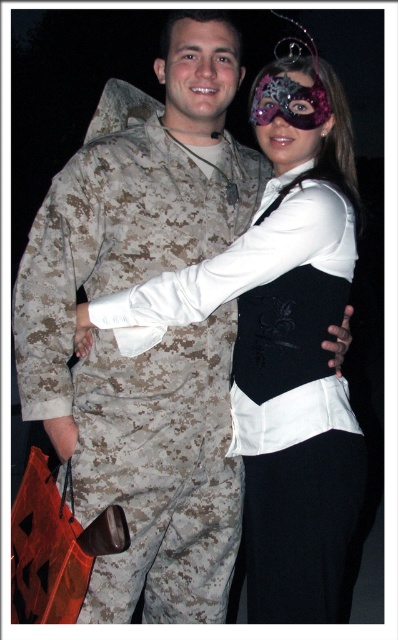
Measure the distance between smooth skin face at center and camera.

smooth skin face at center is 1.76 meters away from camera.

The image size is (398, 640). What do you see at coordinates (200, 74) in the screenshot?
I see `smooth skin face at center` at bounding box center [200, 74].

Who is more forward, (x=199, y=92) or (x=290, y=150)?

Point (x=290, y=150) is in front.

The image size is (398, 640). I want to click on smooth skin face at center, so click(x=200, y=74).

Does matte camouflage uniform at center have a greater width compared to sparkly purple mask at center?

Correct, the width of matte camouflage uniform at center exceeds that of sparkly purple mask at center.

Between point (327, 570) and point (292, 156), which one is positioned behind?

Positioned behind is point (292, 156).

The width and height of the screenshot is (398, 640). I want to click on matte camouflage uniform at center, so click(x=296, y=438).

Is point (238, 417) positioned before point (212, 29)?

No, it is behind (212, 29).

Does matte camouflage uniform at center appear over smooth skin face at center?

No.

Is point (351, 529) behind point (230, 80)?

That is False.

At what (x,y) coordinates should I click in order to perform the action: click on matte camouflage uniform at center. Please return your answer as a coordinate pair (x, y). Looking at the image, I should click on (296, 438).